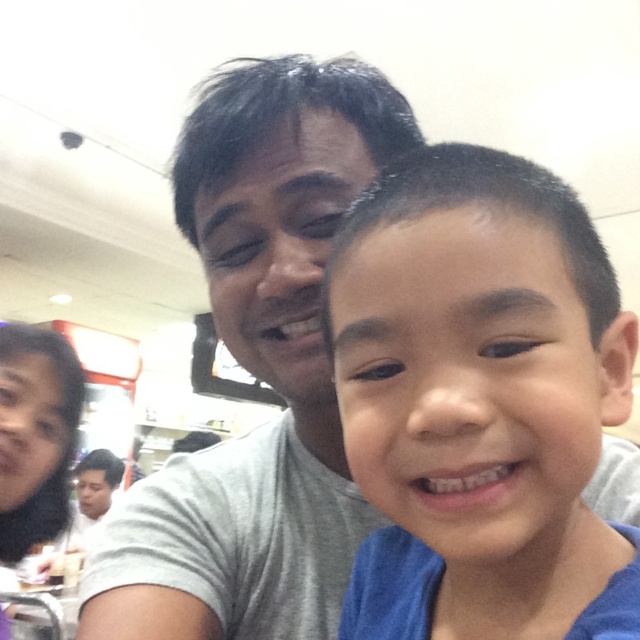
Can you confirm if blue cotton shirt at right is bigger than gray cotton shirt at center?

No.

This screenshot has height=640, width=640. Find the location of `blue cotton shirt at right`. blue cotton shirt at right is located at coordinates (480, 403).

Is point (547, 269) positioned after point (308, 131)?

That is False.

The height and width of the screenshot is (640, 640). In order to click on blue cotton shirt at right in this screenshot , I will do `click(480, 403)`.